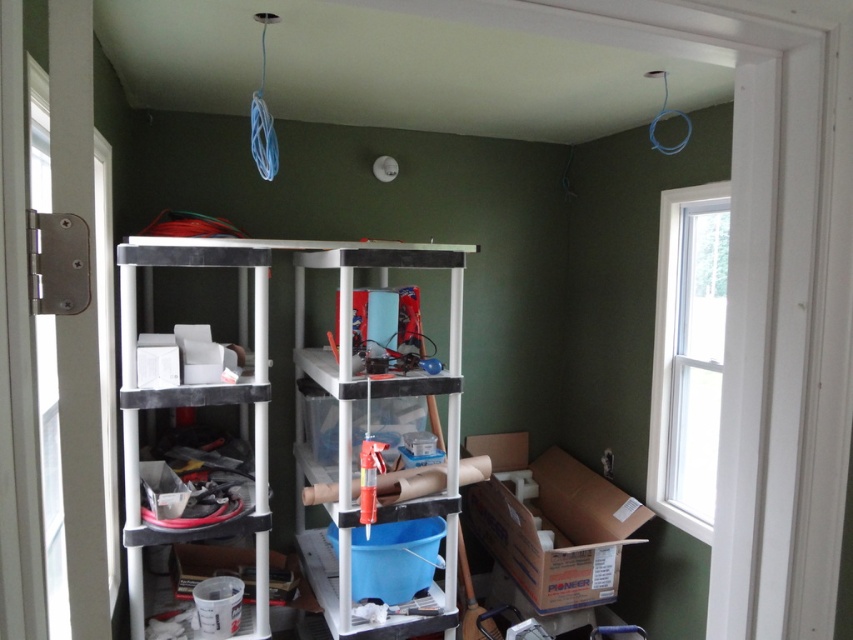
You have a large box that is 1.2 meters wide and need to place it on one of the shelves. The white plastic shelf at center and the matte black shelving unit at left are both available. Which shelf can accommodate the box without it overhanging?

The white plastic shelf at center can accommodate the large box since its width surpasses that of the matte black shelving unit at left, making it wider and thus able to hold the 1.2 meter wide box without overhang.

You are standing in the room and want to place a new item on the cardboard box at lower right. According to the image, where exactly should you place it?

The cardboard box at lower right is located at the 2D coordinates point (550, 522), so you should place the new item there.

You are organizing items in a cluttered room. You have a cardboard box at lower right and a white plastic shelf at center. Which object can hold more items based on their sizes?

The white plastic shelf at center can hold more items because it is larger in size than the cardboard box at lower right.